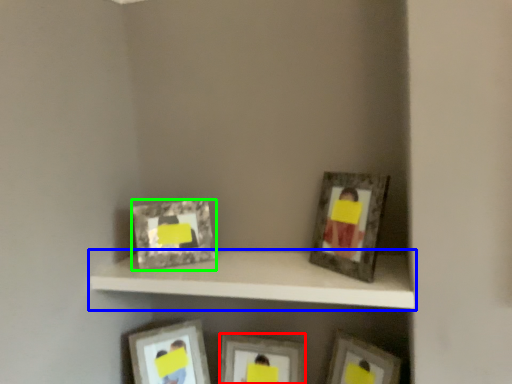
Question: Considering the real-world distances, which object is closest to picture frame (highlighted by a red box)? shelf (highlighted by a blue box) or picture frame (highlighted by a green box).

Choices:
 (A) shelf
 (B) picture frame

Answer: (A)